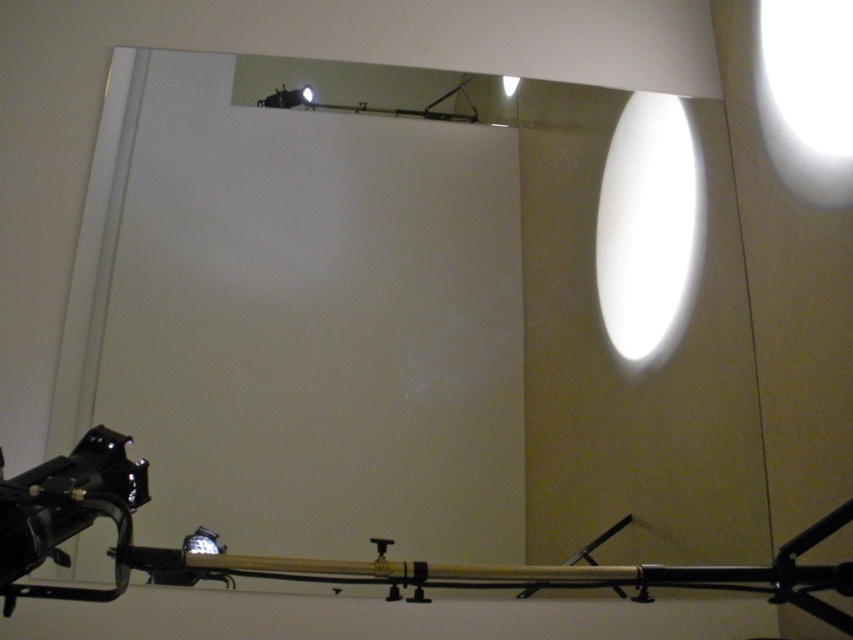
Is the position of white glossy mirror at upper center more distant than that of matte white light at upper center?

That is False.

Is white glossy mirror at upper center shorter than matte white light at upper center?

No, white glossy mirror at upper center is not shorter than matte white light at upper center.

Between point (86, 301) and point (517, 77), which one is positioned behind?

The point (517, 77) is behind.

Image resolution: width=853 pixels, height=640 pixels. What are the coordinates of `white glossy mirror at upper center` in the screenshot? It's located at [x=416, y=323].

Does black metal/wooden pole at lower center have a smaller size compared to matte white light at upper center?

No.

Between black metal/wooden pole at lower center and matte white light at upper center, which one is positioned higher?

matte white light at upper center

Does point (347, 564) come in front of point (509, 90)?

Yes, point (347, 564) is in front of point (509, 90).

At what (x,y) coordinates should I click in order to perform the action: click on black metal/wooden pole at lower center. Please return your answer as a coordinate pair (x, y). Looking at the image, I should click on pos(331,560).

This screenshot has height=640, width=853. I want to click on white glossy mirror at upper center, so click(x=416, y=323).

Between white glossy mirror at upper center and black glossy video camera at lower left, which one is positioned lower?

black glossy video camera at lower left is lower down.

This screenshot has width=853, height=640. I want to click on white glossy mirror at upper center, so click(x=416, y=323).